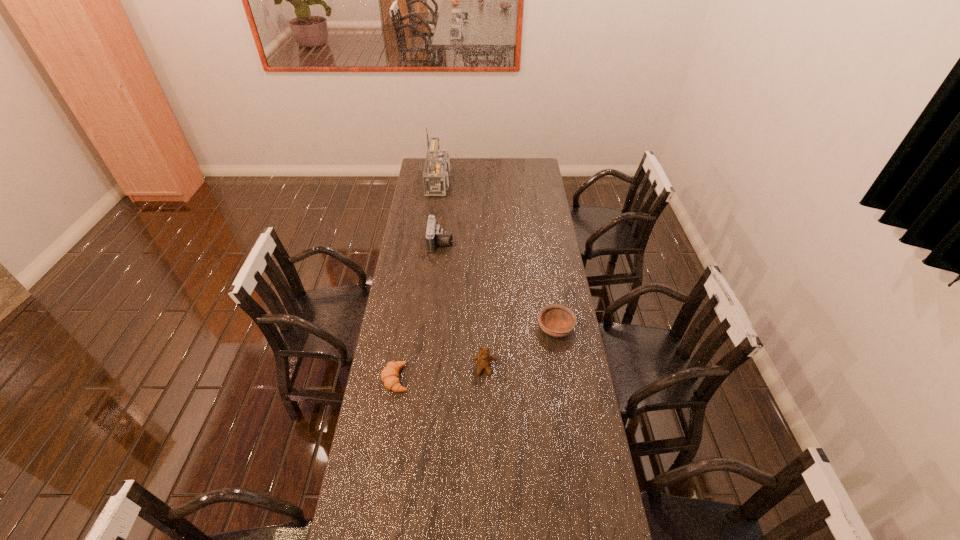
Image resolution: width=960 pixels, height=540 pixels. Identify the location of vacant space that satisfies the following two spatial constraints: 1. at the front of the camera with an open lens cover; 2. on the right side of the rightmost object. (432, 328).

You are a GUI agent. You are given a task and a screenshot of the screen. Output one action in this format:
    pyautogui.click(x=<x>, y=<y>)
    Task: Click on the free spot that satisfies the following two spatial constraints: 1. at the front of the camera with an open lens cover; 2. on the right side of the rightmost object
    The width and height of the screenshot is (960, 540).
    Given the screenshot: What is the action you would take?
    pyautogui.click(x=432, y=328)